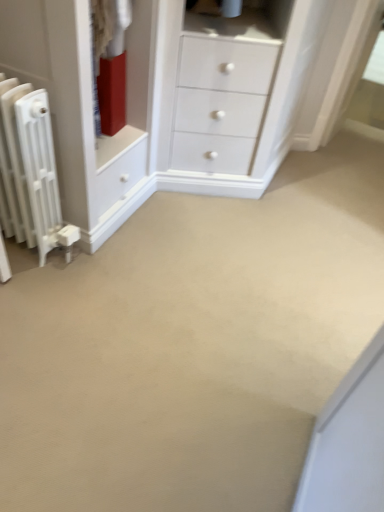
Question: Does point [66, 193] appear closer or farther from the camera than point [29, 111]?

Choices:
 (A) closer
 (B) farther

Answer: (B)

Question: From the image's perspective, is matte white chest of drawers at left above or below white matte radiator at left?

Choices:
 (A) above
 (B) below

Answer: (A)

Question: From a real-world perspective, relative to white matte radiator at left, is matte white chest of drawers at left vertically above or below?

Choices:
 (A) below
 (B) above

Answer: (B)

Question: Is white matte radiator at left inside or outside of matte white chest of drawers at left?

Choices:
 (A) outside
 (B) inside

Answer: (A)

Question: Considering their positions, is white matte radiator at left located in front of or behind matte white chest of drawers at left?

Choices:
 (A) behind
 (B) front

Answer: (B)

Question: Does point 52,202 appear closer or farther from the camera than point 147,146?

Choices:
 (A) farther
 (B) closer

Answer: (B)

Question: From a real-world perspective, is white matte radiator at left physically located above or below matte white chest of drawers at left?

Choices:
 (A) below
 (B) above

Answer: (A)